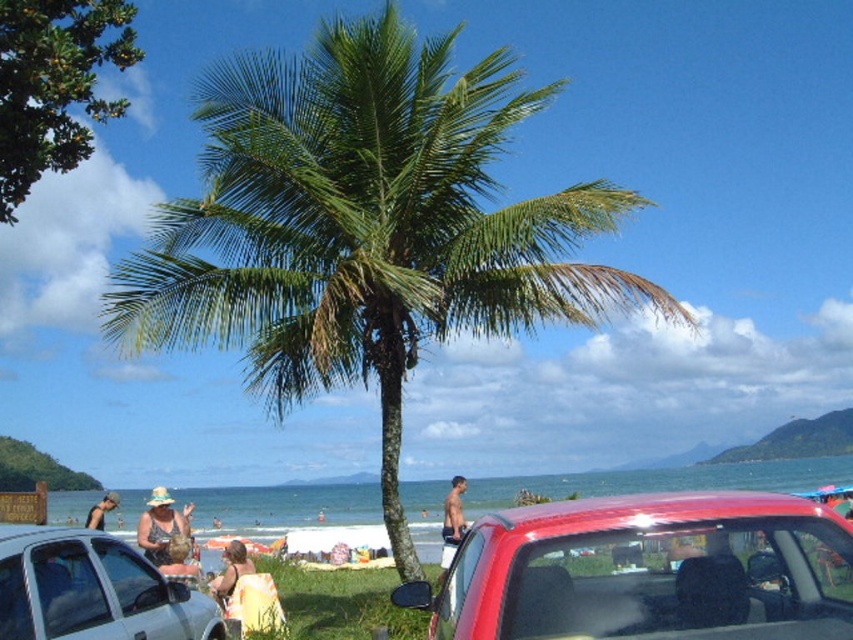
Question: Does skinny man at center have a lesser width compared to beige fabric bag at center?

Choices:
 (A) no
 (B) yes

Answer: (B)

Question: Among these points, which one is nearest to the camera?

Choices:
 (A) (219, 580)
 (B) (152, 513)
 (C) (102, 516)
 (D) (183, 545)

Answer: (A)

Question: Based on their relative distances, which object is farther from the beige fabric bag at center?

Choices:
 (A) beige fabric dress at center
 (B) skinny man at center
 (C) green leafy palm tree at center

Answer: (C)

Question: Which point is closer to the camera?

Choices:
 (A) tap(149, 531)
 (B) tap(502, 576)
 (C) tap(381, 211)

Answer: (B)

Question: Can you confirm if shiny red car at center is positioned above silver metallic car at lower left?

Choices:
 (A) no
 (B) yes

Answer: (B)

Question: Is green leafy palm tree at center to the left of matte yellow hat at lower center from the viewer's perspective?

Choices:
 (A) yes
 (B) no

Answer: (B)